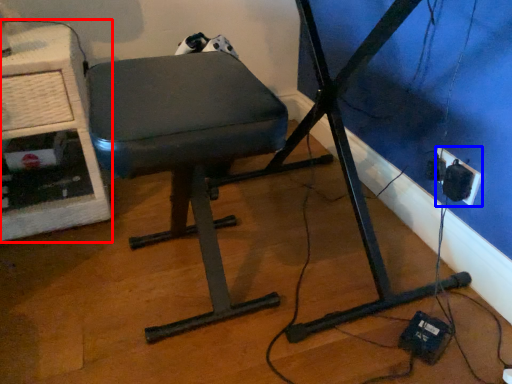
Question: Among these objects, which one is nearest to the camera, computer desk (highlighted by a red box) or electric outlet (highlighted by a blue box)?

Choices:
 (A) computer desk
 (B) electric outlet

Answer: (A)